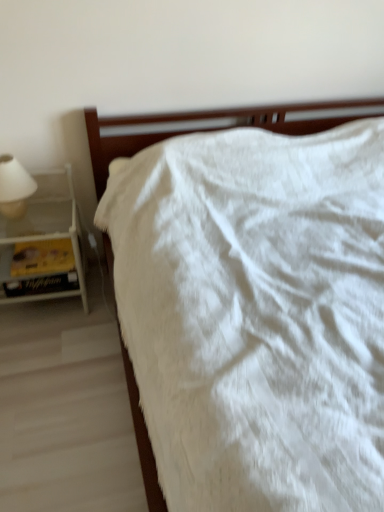
You are a GUI agent. You are given a task and a screenshot of the screen. Output one action in this format:
    pyautogui.click(x=<x>, y=<y>)
    Task: Click on the vacant region above yellow paper at left (from a real-world perspective)
    This screenshot has height=512, width=384.
    Given the screenshot: What is the action you would take?
    pyautogui.click(x=37, y=268)